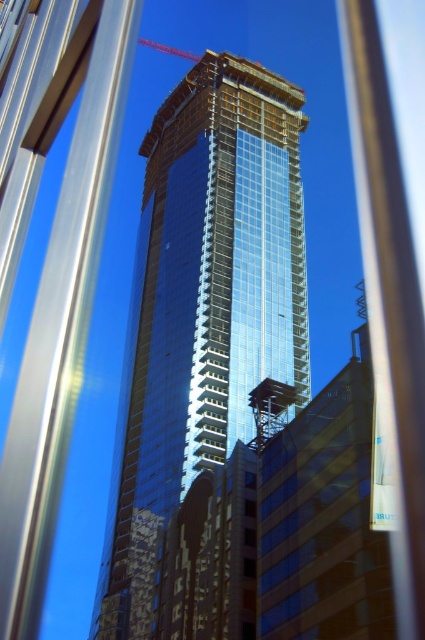
You are a photographer standing outside the vehicle and want to capture a photo of the shiny glass tower at center and the metallic red crane at upper center. Based on their sizes in the image, which object would appear taller in your photo?

The shiny glass tower at center appears taller than the metallic red crane at upper center in the photo because it has a greater height compared to the crane.

You are an architect observing the construction site through a window with vertical metallic bars. You notice the shiny glass tower at center and the metallic red crane at upper center. Which object appears bigger in the view?

Result: The shiny glass tower at center appears bigger in the view because it has a larger size compared to the metallic red crane at upper center.

Based on the coordinates provided in the scene description, where is the shiny glass tower at center located?

The shiny glass tower at center is located at point (203, 308).